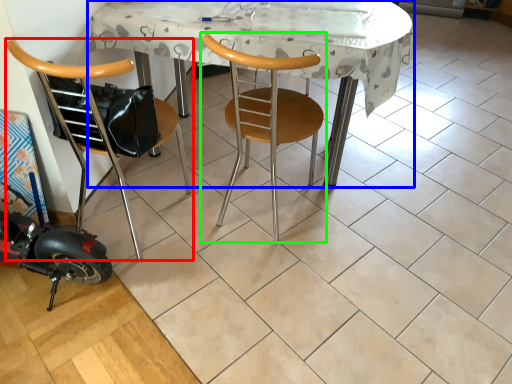
Question: Estimate the real-world distances between objects in this image. Which object is farther from chair (highlighted by a red box), table (highlighted by a blue box) or chair (highlighted by a green box)?

Choices:
 (A) table
 (B) chair

Answer: (A)